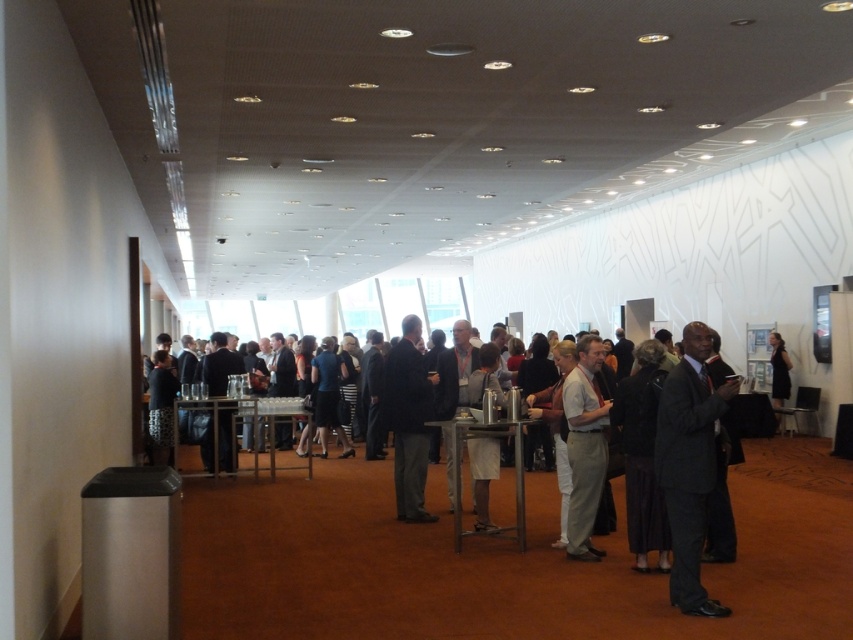
Question: Which object is closer to the camera taking this photo?

Choices:
 (A) dark gray suit at center
 (B) dark suit at center
 (C) light beige fabric shirt at center

Answer: (B)

Question: Based on their relative distances, which object is farther from the dark gray suit at center?

Choices:
 (A) dark suit at center
 (B) dark gray suit at right

Answer: (B)

Question: Which of the following is the closest to the observer?

Choices:
 (A) dark brown leather jacket at right
 (B) dark gray suit at right

Answer: (B)

Question: Can you confirm if dark gray suit at center is positioned above light beige fabric shirt at center?

Choices:
 (A) no
 (B) yes

Answer: (B)

Question: Can you confirm if dark gray suit at right is positioned to the left of light beige fabric shirt at center?

Choices:
 (A) no
 (B) yes

Answer: (A)

Question: Is dark suit at center above dark brown leather jacket at right?

Choices:
 (A) no
 (B) yes

Answer: (A)